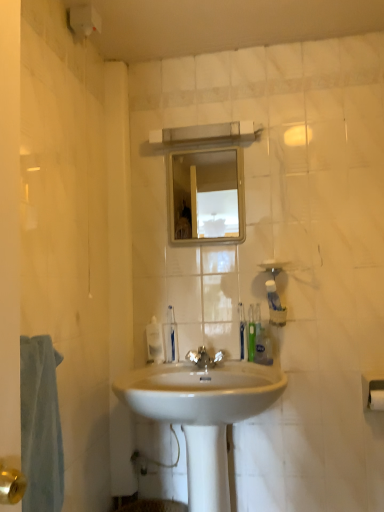
Question: Can you confirm if white matte toilet paper at lower right is shorter than translucent plastic soap dispenser at center?

Choices:
 (A) no
 (B) yes

Answer: (B)

Question: Can you confirm if white matte toilet paper at lower right is thinner than translucent plastic soap dispenser at center?

Choices:
 (A) yes
 (B) no

Answer: (B)

Question: Considering the relative positions of white matte toilet paper at lower right and translucent plastic soap dispenser at center in the image provided, is white matte toilet paper at lower right behind translucent plastic soap dispenser at center?

Choices:
 (A) yes
 (B) no

Answer: (B)

Question: Is white matte toilet paper at lower right oriented towards translucent plastic soap dispenser at center?

Choices:
 (A) no
 (B) yes

Answer: (A)

Question: From the image's perspective, is white matte toilet paper at lower right located beneath translucent plastic soap dispenser at center?

Choices:
 (A) no
 (B) yes

Answer: (B)

Question: Can you confirm if white matte toilet paper at lower right is positioned to the left of translucent plastic soap dispenser at center?

Choices:
 (A) yes
 (B) no

Answer: (B)

Question: Could you tell me if white glossy sink at center is turned towards white matte toilet paper at lower right?

Choices:
 (A) no
 (B) yes

Answer: (A)

Question: Is white glossy sink at center far from white matte toilet paper at lower right?

Choices:
 (A) yes
 (B) no

Answer: (B)

Question: Can you confirm if white glossy sink at center is bigger than white matte toilet paper at lower right?

Choices:
 (A) no
 (B) yes

Answer: (B)

Question: From the image's perspective, is white glossy sink at center under white matte toilet paper at lower right?

Choices:
 (A) no
 (B) yes

Answer: (B)

Question: Is white glossy sink at center located outside white matte toilet paper at lower right?

Choices:
 (A) no
 (B) yes

Answer: (B)

Question: Considering the relative positions of white glossy sink at center and white matte toilet paper at lower right in the image provided, is white glossy sink at center to the left of white matte toilet paper at lower right from the viewer's perspective?

Choices:
 (A) yes
 (B) no

Answer: (A)

Question: From the image's perspective, would you say clear glass mirror at upper center is positioned over white matte toilet paper at lower right?

Choices:
 (A) yes
 (B) no

Answer: (A)